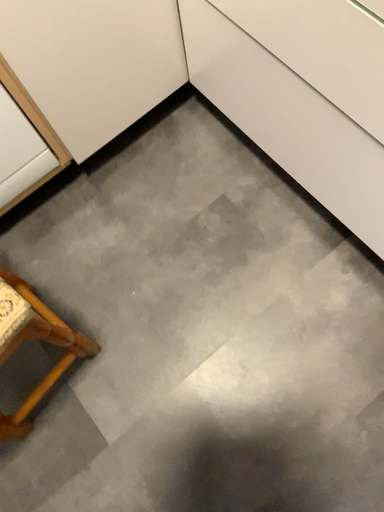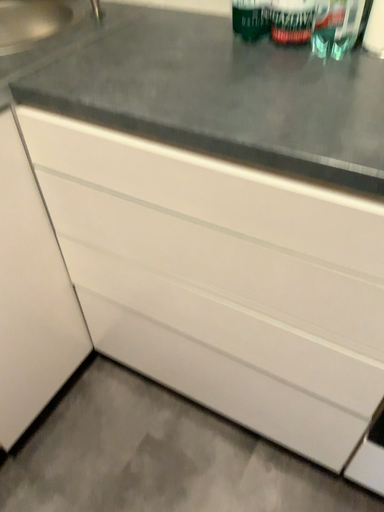
Question: Which way did the camera rotate in the video?

Choices:
 (A) rotated left
 (B) rotated right

Answer: (B)